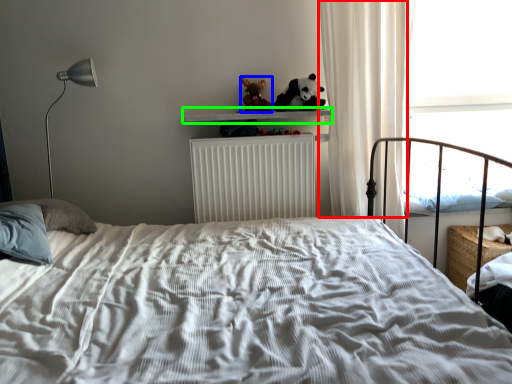
Question: Based on their relative distances, which object is farther from curtain (highlighted by a red box)? Choose from figurine (highlighted by a blue box) and window sill (highlighted by a green box).

Choices:
 (A) figurine
 (B) window sill

Answer: (A)